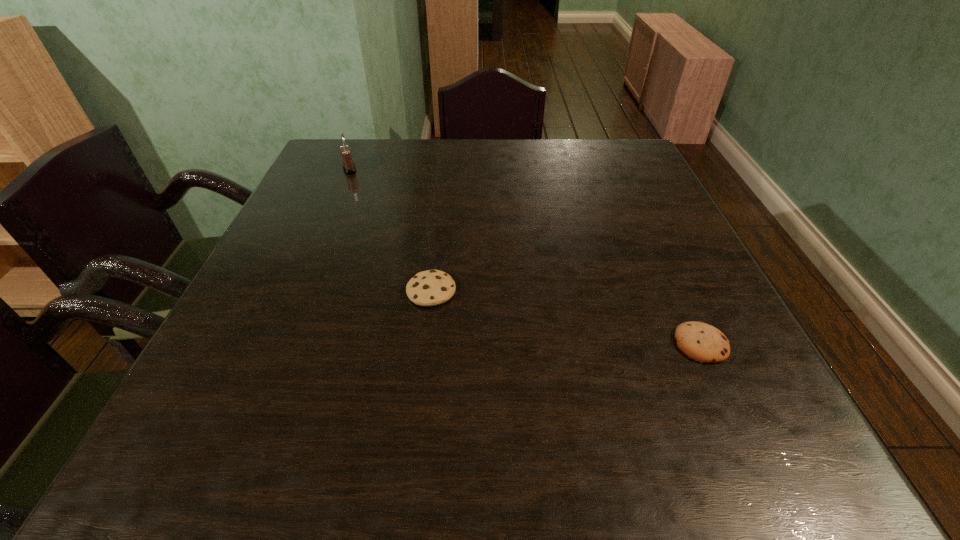
At what (x,y) coordinates should I click in order to perform the action: click on free space that satisfies the following two spatial constraints: 1. on the front side of the second object from right to left; 2. on the right side of the tallest object. Please return your answer as a coordinate pair (x, y). Image resolution: width=960 pixels, height=540 pixels. Looking at the image, I should click on (298, 291).